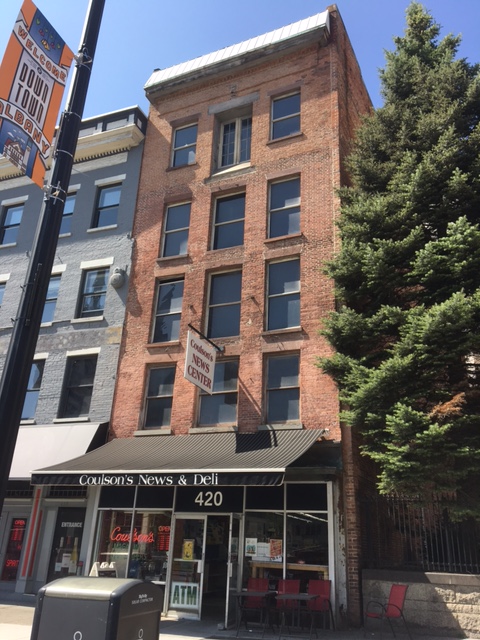
At what (x,y) coordinates should I click in order to perform the action: click on red chair. Please return your answer as a coordinate pair (x, y). The image size is (480, 640). Looking at the image, I should click on (393, 605), (318, 588), (284, 584), (253, 582).